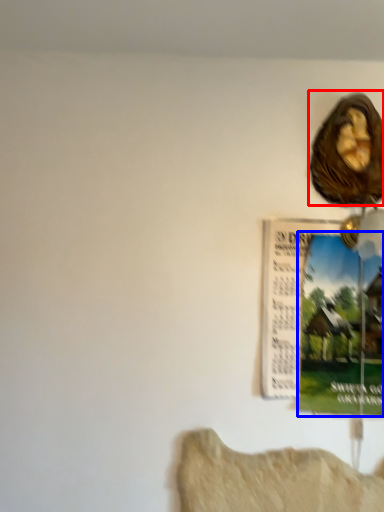
Question: Which point is further to the camera, art (highlighted by a red box) or poster page (highlighted by a blue box)?

Choices:
 (A) art
 (B) poster page

Answer: (A)